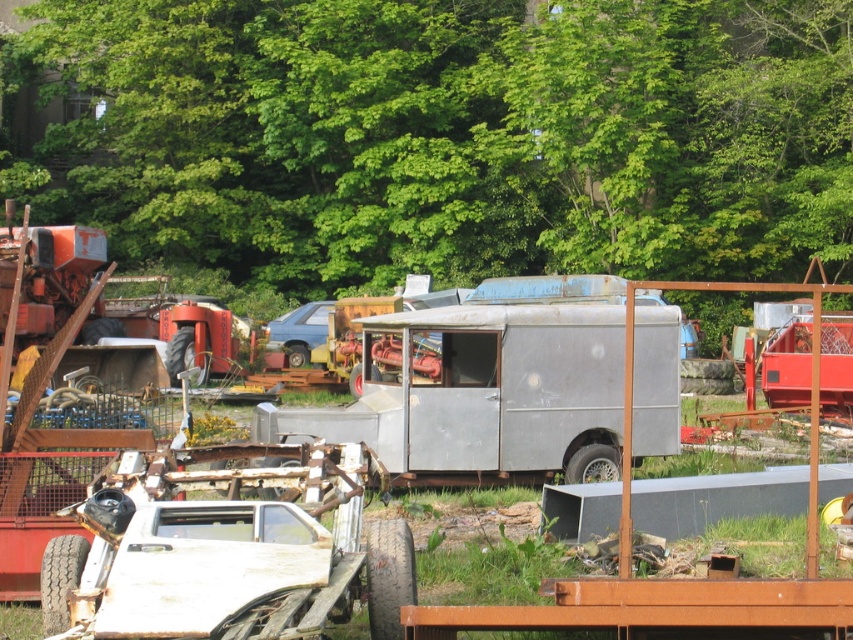
Between point (560, 326) and point (271, 337), which one is positioned behind?

The point (271, 337) is behind.

Measure the distance between point (453, 428) and camera.

Point (453, 428) and camera are 18.30 meters apart from each other.

The width and height of the screenshot is (853, 640). Find the location of `rusty metal trailer truck at center`. rusty metal trailer truck at center is located at coordinates (480, 394).

Can you confirm if green leafy tree at upper center is wider than rusty metal trailer truck at center?

Yes.

Does green leafy tree at upper center have a larger size compared to rusty metal trailer truck at center?

Indeed, green leafy tree at upper center has a larger size compared to rusty metal trailer truck at center.

Describe the element at coordinates (451, 134) in the screenshot. The image size is (853, 640). I see `green leafy tree at upper center` at that location.

Identify the location of green leafy tree at upper center. (451, 134).

Does green leafy tree at upper center have a larger size compared to metallic blue van at center?

Correct, green leafy tree at upper center is larger in size than metallic blue van at center.

Which of these two, green leafy tree at upper center or metallic blue van at center, stands shorter?

With less height is metallic blue van at center.

Who is more distant from viewer, (x=251, y=92) or (x=288, y=317)?

Positioned behind is point (x=251, y=92).

At what (x,y) coordinates should I click in order to perform the action: click on green leafy tree at upper center. Please return your answer as a coordinate pair (x, y). This screenshot has width=853, height=640. Looking at the image, I should click on (451, 134).